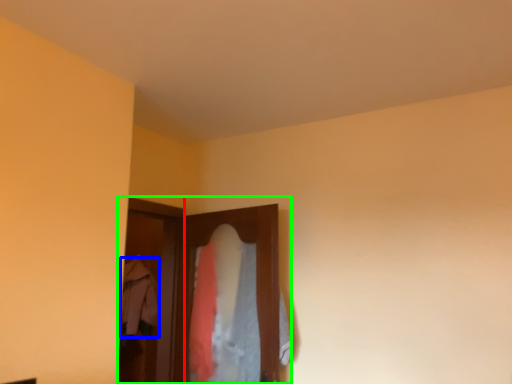
Question: Which is nearer to the screen door (highlighted by a red box)? clothing (highlighted by a blue box) or closet (highlighted by a green box).

Choices:
 (A) clothing
 (B) closet

Answer: (A)